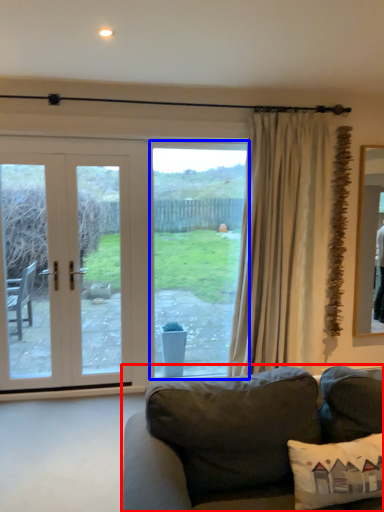
Question: Among these objects, which one is nearest to the camera, studio couch (highlighted by a red box) or window (highlighted by a blue box)?

Choices:
 (A) studio couch
 (B) window

Answer: (A)